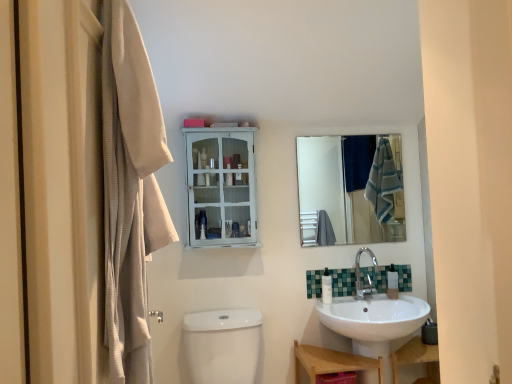
Question: In the image, is clear glass mirror at upper center on the left side or the right side of white painted wood cabinet at upper center?

Choices:
 (A) right
 (B) left

Answer: (A)

Question: From the image's perspective, is clear glass mirror at upper center located above or below white painted wood cabinet at upper center?

Choices:
 (A) above
 (B) below

Answer: (B)

Question: Which object is positioned closest to the silver metallic faucet at lower right?

Choices:
 (A) white glossy soap dispenser at lower center, which ranks as the second toiletry in right-to-left order
 (B) metallic silver faucet at lower center
 (C) white glossy soap dispenser at lower right, the 2th toiletry in the left-to-right sequence
 (D) white painted wood cabinet at upper center
 (E) beige textured towel at left

Answer: (B)

Question: Estimate the real-world distances between objects in this image. Which object is farther from the white glossy soap dispenser at lower right, which is the 1th toiletry from right to left?

Choices:
 (A) clear glass mirror at upper center
 (B) beige textured towel at left
 (C) white painted wood cabinet at upper center
 (D) wooden shelf at lower right
 (E) white glossy toilet bowl at lower center

Answer: (B)